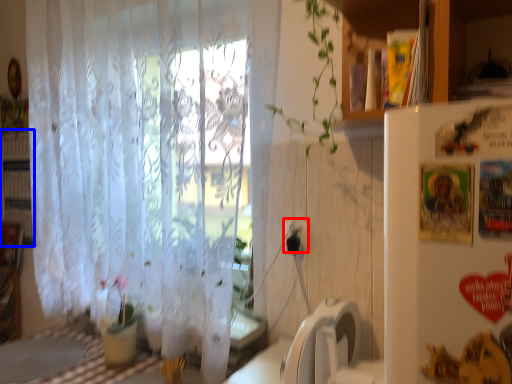
Question: Which of the following is the farthest to the observer, electric outlet (highlighted by a red box) or bookshelf (highlighted by a blue box)?

Choices:
 (A) electric outlet
 (B) bookshelf

Answer: (B)